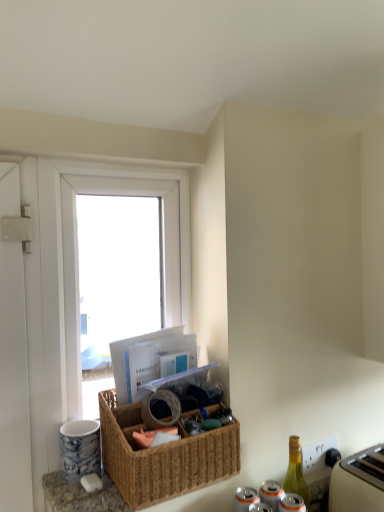
Question: From a real-world perspective, does white plastic toaster at lower right stand above green glass bottle at lower right?

Choices:
 (A) yes
 (B) no

Answer: (B)

Question: Is white plastic toaster at lower right shorter than green glass bottle at lower right?

Choices:
 (A) no
 (B) yes

Answer: (B)

Question: Considering the relative sizes of white plastic toaster at lower right and green glass bottle at lower right in the image provided, is white plastic toaster at lower right smaller than green glass bottle at lower right?

Choices:
 (A) yes
 (B) no

Answer: (B)

Question: Considering the relative sizes of white plastic toaster at lower right and green glass bottle at lower right in the image provided, is white plastic toaster at lower right thinner than green glass bottle at lower right?

Choices:
 (A) no
 (B) yes

Answer: (A)

Question: Are white plastic toaster at lower right and green glass bottle at lower right far apart?

Choices:
 (A) yes
 (B) no

Answer: (B)

Question: From the image's perspective, is white plastic toaster at lower right located beneath green glass bottle at lower right?

Choices:
 (A) no
 (B) yes

Answer: (B)

Question: Is white plastic window at upper left at the back of woven brown picnic basket at center?

Choices:
 (A) no
 (B) yes

Answer: (B)

Question: Is woven brown picnic basket at center not within white plastic window at upper left?

Choices:
 (A) no
 (B) yes

Answer: (B)

Question: From the image's perspective, is woven brown picnic basket at center over white plastic window at upper left?

Choices:
 (A) no
 (B) yes

Answer: (A)

Question: Considering the relative sizes of woven brown picnic basket at center and white plastic window at upper left in the image provided, is woven brown picnic basket at center bigger than white plastic window at upper left?

Choices:
 (A) no
 (B) yes

Answer: (B)

Question: Can white plastic window at upper left be found inside woven brown picnic basket at center?

Choices:
 (A) no
 (B) yes

Answer: (A)

Question: Is woven brown picnic basket at center closer to the viewer compared to white plastic window at upper left?

Choices:
 (A) yes
 (B) no

Answer: (A)

Question: Does white plastic toaster at lower right have a greater width compared to white plastic window at upper left?

Choices:
 (A) no
 (B) yes

Answer: (B)